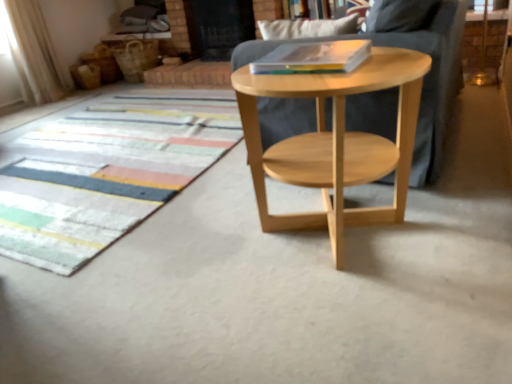
The image size is (512, 384). I want to click on blank space to the left of natural wood side table at center, so click(x=185, y=258).